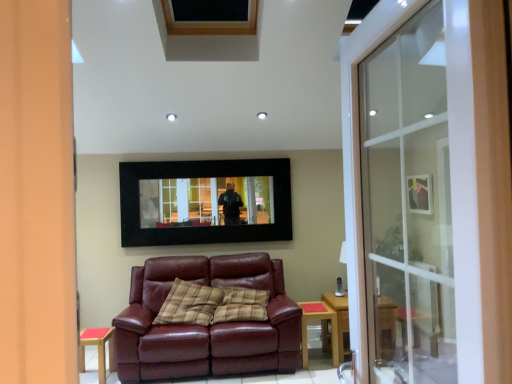
Question: Is there a large distance between matte black picture frame at upper right, acting as the second picture frame starting from the left, and plaid fabric pillow at center?

Choices:
 (A) yes
 (B) no

Answer: (A)

Question: Considering the relative sizes of matte black picture frame at upper right, which is counted as the 1th picture frame, starting from the right, and plaid fabric pillow at center in the image provided, is matte black picture frame at upper right, which is counted as the 1th picture frame, starting from the right, smaller than plaid fabric pillow at center?

Choices:
 (A) yes
 (B) no

Answer: (A)

Question: Is the depth of matte black picture frame at upper right, acting as the second picture frame starting from the left, greater than that of plaid fabric pillow at center?

Choices:
 (A) no
 (B) yes

Answer: (B)

Question: Can you confirm if matte black picture frame at upper right, which is counted as the 1th picture frame, starting from the right, is positioned to the right of plaid fabric pillow at center?

Choices:
 (A) yes
 (B) no

Answer: (A)

Question: Is matte black picture frame at upper right, which is counted as the 1th picture frame, starting from the right, shorter than plaid fabric pillow at center?

Choices:
 (A) no
 (B) yes

Answer: (B)

Question: Do you think transparent glass screen door at right is within wooden side table at lower left, or outside of it?

Choices:
 (A) outside
 (B) inside

Answer: (A)

Question: Does point (453, 69) appear closer or farther from the camera than point (110, 360)?

Choices:
 (A) closer
 (B) farther

Answer: (A)

Question: From the image's perspective, is transparent glass screen door at right located above or below wooden side table at lower left?

Choices:
 (A) above
 (B) below

Answer: (A)

Question: Considering their positions, is transparent glass screen door at right located in front of or behind wooden side table at lower left?

Choices:
 (A) front
 (B) behind

Answer: (A)

Question: In the image, is matte black picture frame at upper right, acting as the second picture frame starting from the left, positioned in front of or behind transparent glass screen door at right?

Choices:
 (A) behind
 (B) front

Answer: (A)

Question: From the image's perspective, is matte black picture frame at upper right, which is counted as the 1th picture frame, starting from the right, positioned above or below transparent glass screen door at right?

Choices:
 (A) above
 (B) below

Answer: (A)

Question: Considering the positions of matte black picture frame at upper right, acting as the second picture frame starting from the left, and transparent glass screen door at right in the image, is matte black picture frame at upper right, acting as the second picture frame starting from the left, wider or thinner than transparent glass screen door at right?

Choices:
 (A) thin
 (B) wide

Answer: (A)

Question: Based on their sizes in the image, would you say matte black picture frame at upper right, which is counted as the 1th picture frame, starting from the right, is bigger or smaller than transparent glass screen door at right?

Choices:
 (A) big
 (B) small

Answer: (B)

Question: Considering the positions of plaid fabric pillow at center and light brown wooden side table at lower center in the image, is plaid fabric pillow at center taller or shorter than light brown wooden side table at lower center?

Choices:
 (A) tall
 (B) short

Answer: (A)

Question: From a real-world perspective, is plaid fabric pillow at center positioned above or below light brown wooden side table at lower center?

Choices:
 (A) above
 (B) below

Answer: (A)